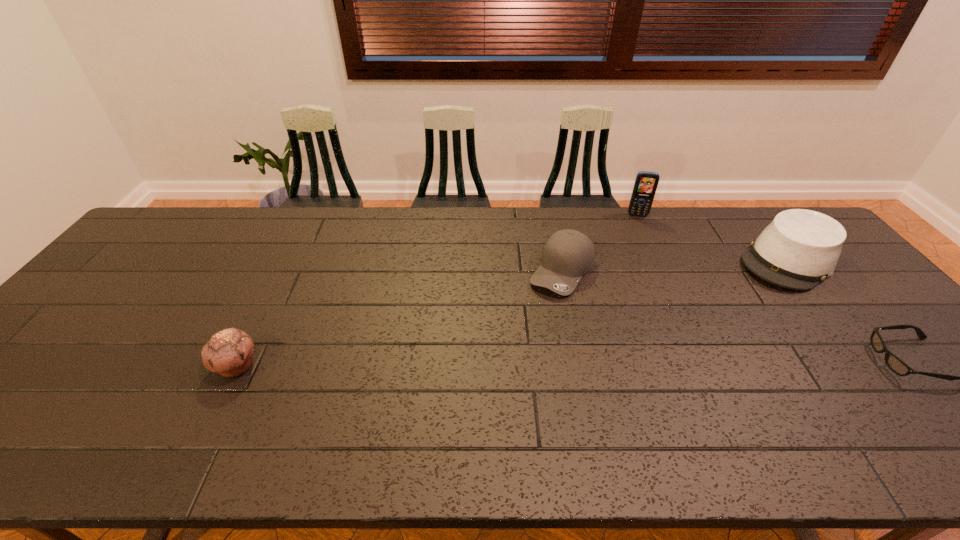
At what (x,y) coordinates should I click in order to perform the action: click on muffin. Please return your answer as a coordinate pair (x, y). This screenshot has height=540, width=960. Looking at the image, I should click on (229, 352).

At what (x,y) coordinates should I click in order to perform the action: click on the second shortest object. Please return your answer as a coordinate pair (x, y). Looking at the image, I should click on (229, 352).

In order to click on hat in this screenshot , I will do `click(800, 248)`.

At what (x,y) coordinates should I click in order to perform the action: click on the second object from left to right. Please return your answer as a coordinate pair (x, y). Image resolution: width=960 pixels, height=540 pixels. Looking at the image, I should click on (568, 254).

Where is `the tallest object`? The height and width of the screenshot is (540, 960). the tallest object is located at coordinates (646, 182).

The height and width of the screenshot is (540, 960). Find the location of `the third object from right to left`. the third object from right to left is located at coordinates (646, 182).

Where is `vacant area situated on the right of the leftmost object`? The image size is (960, 540). vacant area situated on the right of the leftmost object is located at coordinates (418, 366).

You are a GUI agent. You are given a task and a screenshot of the screen. Output one action in this format:
    pyautogui.click(x=<x>, y=<y>)
    Task: Click on the blank space located on the front-facing side of the hat
    This screenshot has height=540, width=960.
    Given the screenshot: What is the action you would take?
    pyautogui.click(x=684, y=348)

Locate an element on the screen. Image resolution: width=960 pixels, height=540 pixels. vacant space located 0.360m on the front-facing side of the hat is located at coordinates (693, 340).

You are a GUI agent. You are given a task and a screenshot of the screen. Output one action in this format:
    pyautogui.click(x=<x>, y=<y>)
    Task: Click on the vacant space located on the front-facing side of the hat
    
    Given the screenshot: What is the action you would take?
    pyautogui.click(x=748, y=293)